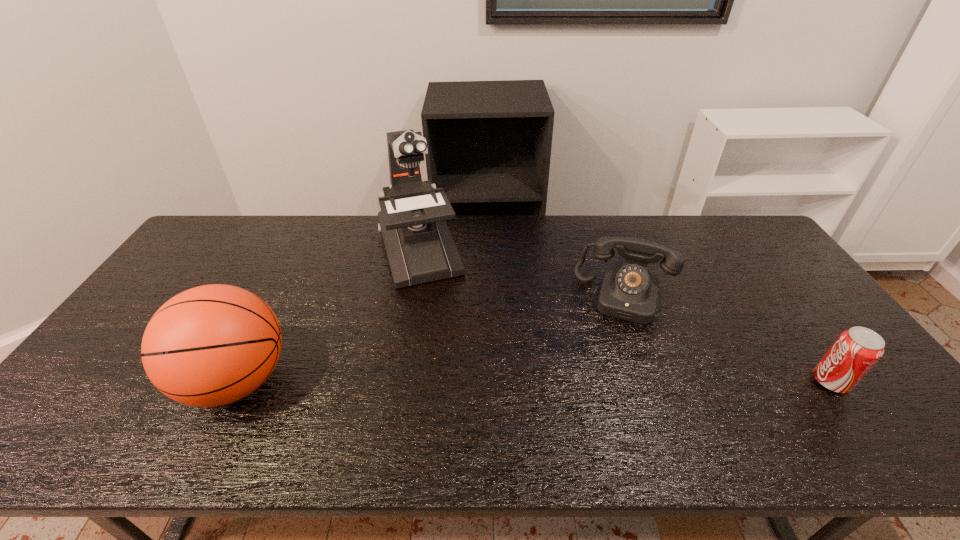
Where is `basketball`? This screenshot has width=960, height=540. basketball is located at coordinates (211, 345).

Where is `the third shortest object`? The width and height of the screenshot is (960, 540). the third shortest object is located at coordinates (211, 345).

Identify the location of soda can. The height and width of the screenshot is (540, 960). 856,350.

Locate an element on the screen. This screenshot has width=960, height=540. the tallest object is located at coordinates (x=419, y=246).

At what (x,y) coordinates should I click in order to perform the action: click on the third object from right to left. Please return your answer as a coordinate pair (x, y). Looking at the image, I should click on (419, 246).

The image size is (960, 540). I want to click on telephone, so click(629, 291).

At what (x,y) coordinates should I click in order to perform the action: click on free space located 0.060m on the right of the leftmost object. Please return your answer as a coordinate pair (x, y). This screenshot has width=960, height=540. Looking at the image, I should click on (317, 381).

At what (x,y) coordinates should I click in order to perform the action: click on free space located on the logo side of the rightmost object. Please return your answer as a coordinate pair (x, y). The width and height of the screenshot is (960, 540). Looking at the image, I should click on (757, 381).

The image size is (960, 540). In order to click on vacant region located on the logo side of the rightmost object in this screenshot , I will do tap(673, 381).

Where is `vacant region located 0.320m on the logo side of the rightmost object`? The image size is (960, 540). vacant region located 0.320m on the logo side of the rightmost object is located at coordinates (685, 381).